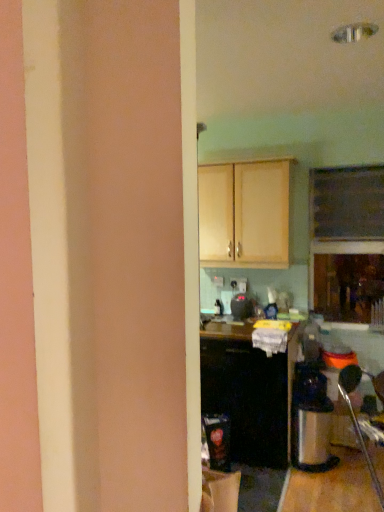
Question: Which direction should I rotate to face light wood cabinet at upper center, arranged as the 1th cabinetry when viewed from the top, — up or down?

Choices:
 (A) down
 (B) up

Answer: (B)

Question: Considering the relative sizes of black plastic toaster at center and black matte cabinet at center, which is the first cabinetry in bottom-to-top order, in the image provided, is black plastic toaster at center taller than black matte cabinet at center, which is the first cabinetry in bottom-to-top order,?

Choices:
 (A) yes
 (B) no

Answer: (B)

Question: Is black plastic toaster at center positioned with its back to black matte cabinet at center, which is the first cabinetry in bottom-to-top order?

Choices:
 (A) no
 (B) yes

Answer: (A)

Question: From a real-world perspective, does black plastic toaster at center sit lower than black matte cabinet at center, which is the first cabinetry in bottom-to-top order?

Choices:
 (A) no
 (B) yes

Answer: (A)

Question: Can you confirm if black plastic toaster at center is shorter than black matte cabinet at center, the 2th cabinetry viewed from the top?

Choices:
 (A) no
 (B) yes

Answer: (B)

Question: Is black plastic toaster at center at the left side of black matte cabinet at center, which is the first cabinetry in bottom-to-top order?

Choices:
 (A) yes
 (B) no

Answer: (A)

Question: Is black plastic toaster at center positioned in front of black matte cabinet at center, which is the first cabinetry in bottom-to-top order?

Choices:
 (A) yes
 (B) no

Answer: (B)

Question: Does light wood cabinet at upper center, which is the 2th cabinetry from bottom to top, have a larger size compared to black matte cabinet at center, which is the first cabinetry in bottom-to-top order?

Choices:
 (A) no
 (B) yes

Answer: (A)

Question: Is light wood cabinet at upper center, arranged as the 1th cabinetry when viewed from the top, far from black matte cabinet at center, which is the first cabinetry in bottom-to-top order?

Choices:
 (A) no
 (B) yes

Answer: (A)

Question: Is light wood cabinet at upper center, arranged as the 1th cabinetry when viewed from the top, aimed at black matte cabinet at center, the 2th cabinetry viewed from the top?

Choices:
 (A) yes
 (B) no

Answer: (B)

Question: Is light wood cabinet at upper center, which is the 2th cabinetry from bottom to top, directly adjacent to black matte cabinet at center, the 2th cabinetry viewed from the top?

Choices:
 (A) yes
 (B) no

Answer: (B)

Question: From the image's perspective, does light wood cabinet at upper center, which is the 2th cabinetry from bottom to top, appear lower than black matte cabinet at center, which is the first cabinetry in bottom-to-top order?

Choices:
 (A) yes
 (B) no

Answer: (B)

Question: Considering the relative sizes of light wood cabinet at upper center, which is the 2th cabinetry from bottom to top, and black matte cabinet at center, which is the first cabinetry in bottom-to-top order, in the image provided, is light wood cabinet at upper center, which is the 2th cabinetry from bottom to top, smaller than black matte cabinet at center, which is the first cabinetry in bottom-to-top order,?

Choices:
 (A) yes
 (B) no

Answer: (A)

Question: Is black plastic toaster at center positioned with its back to light wood cabinet at upper center, arranged as the 1th cabinetry when viewed from the top?

Choices:
 (A) yes
 (B) no

Answer: (B)